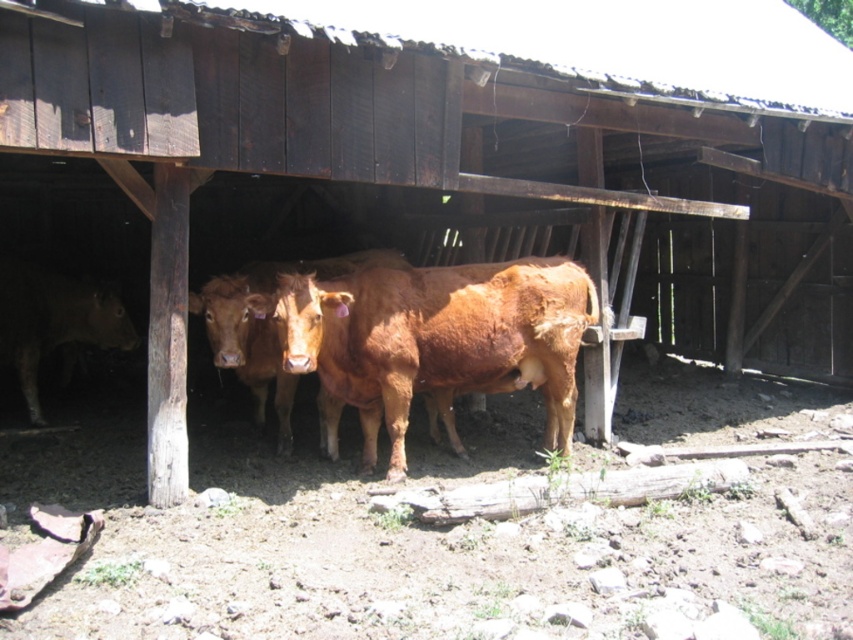
Consider the image. Who is more distant from viewer, [416,321] or [51,308]?

Positioned behind is point [51,308].

Does point (403, 280) come farther from viewer compared to point (7, 262)?

No, (403, 280) is closer to viewer.

Where is `brown rough cow at center`? The image size is (853, 640). brown rough cow at center is located at coordinates (438, 339).

Who is positioned more to the left, brown smooth cow at center or brown smooth cow at left?

brown smooth cow at left

Between brown smooth cow at center and brown smooth cow at left, which one is positioned higher?

brown smooth cow at left is higher up.

Does point (207, 321) come behind point (28, 352)?

No, (207, 321) is closer to viewer.

Identify the location of brown smooth cow at center. (265, 324).

Who is higher up, brown rough cow at center or brown smooth cow at center?

brown smooth cow at center

Does brown rough cow at center appear on the right side of brown smooth cow at center?

Indeed, brown rough cow at center is positioned on the right side of brown smooth cow at center.

Locate an element on the screen. This screenshot has width=853, height=640. brown rough cow at center is located at coordinates [438, 339].